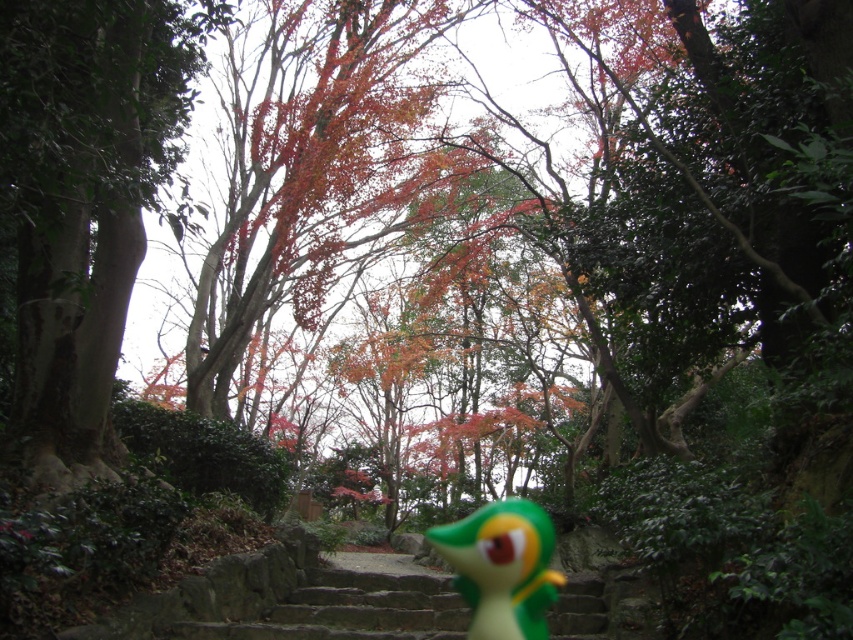
Question: Which point appears closest to the camera in this image?

Choices:
 (A) (70, 275)
 (B) (483, 525)

Answer: (A)

Question: Can you confirm if green smooth tree trunk at left is positioned below green rubber toy at center?

Choices:
 (A) no
 (B) yes

Answer: (A)

Question: Is green smooth tree trunk at left above green rubber toy at center?

Choices:
 (A) no
 (B) yes

Answer: (B)

Question: Which object appears farthest from the camera in this image?

Choices:
 (A) green rubber toy at center
 (B) green smooth tree trunk at left

Answer: (A)

Question: Is green smooth tree trunk at left thinner than green rubber toy at center?

Choices:
 (A) no
 (B) yes

Answer: (A)